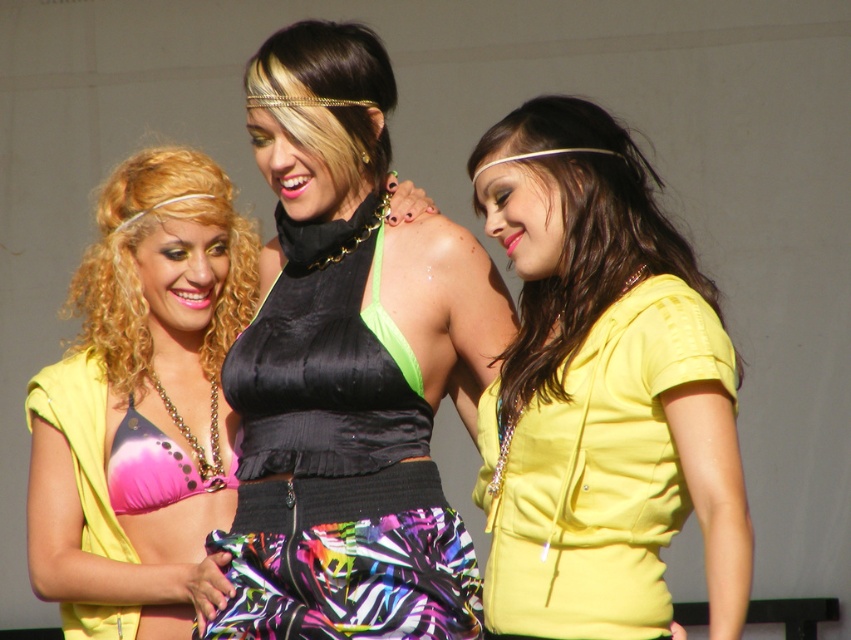
Is yellow matte hoodie at center taller than pink polka dot bikini top at left?

Incorrect, yellow matte hoodie at center's height is not larger of pink polka dot bikini top at left's.

At what (x,y) coordinates should I click in order to perform the action: click on yellow matte hoodie at center. Please return your answer as a coordinate pair (x, y). Looking at the image, I should click on (601, 392).

Can you confirm if matte black bikini top at center is taller than pink satin bikini top at center?

Indeed, matte black bikini top at center has a greater height compared to pink satin bikini top at center.

Is point (130, 179) positioned after point (173, 448)?

Yes, it is behind point (173, 448).

Locate an element on the screen. The image size is (851, 640). matte black bikini top at center is located at coordinates (134, 268).

Does satin black halter top at center have a greater width compared to pink satin bikini top at center?

Yes, satin black halter top at center is wider than pink satin bikini top at center.

Who is higher up, satin black halter top at center or pink satin bikini top at center?

satin black halter top at center is higher up.

Who is more distant from viewer, (264,336) or (140,433)?

The point (140,433) is more distant.

Locate an element on the screen. This screenshot has width=851, height=640. satin black halter top at center is located at coordinates (347, 369).